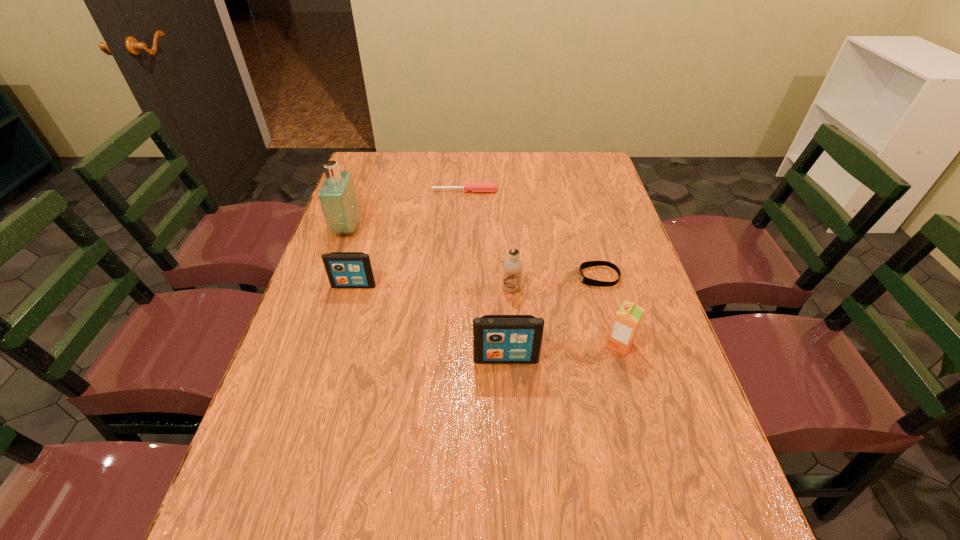
Locate an element on the screen. vacant space that satisfies the following two spatial constraints: 1. on the display of the wristband; 2. on the front screen of the shorter iPod is located at coordinates (601, 286).

Locate an element on the screen. free space that satisfies the following two spatial constraints: 1. on the display of the wristband; 2. on the front screen of the right iPod is located at coordinates click(621, 359).